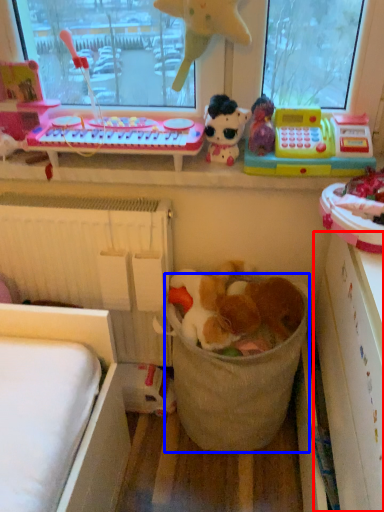
Question: Among these objects, which one is farthest to the camera, shelf (highlighted by a red box) or laundry basket (highlighted by a blue box)?

Choices:
 (A) shelf
 (B) laundry basket

Answer: (B)